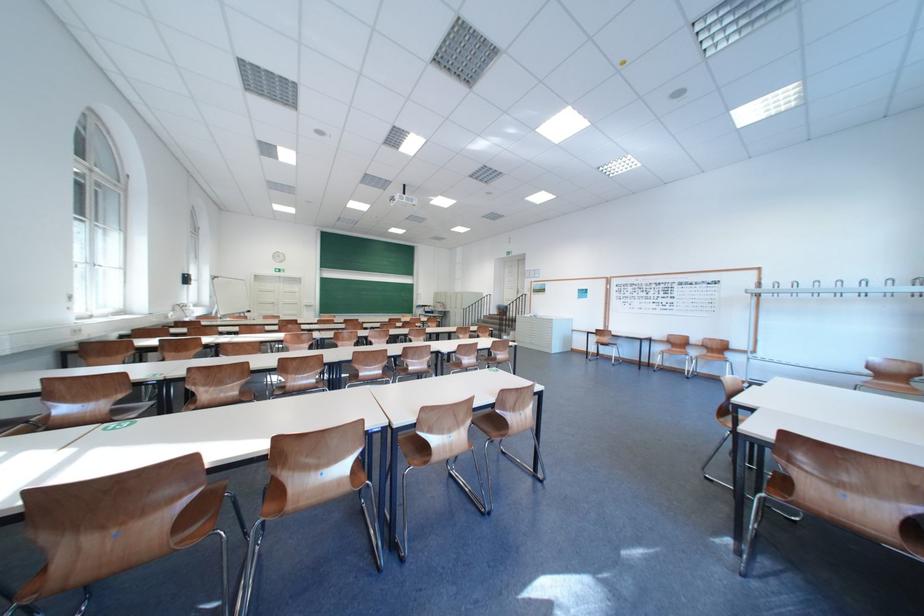
Locate an element on the screen. Image resolution: width=924 pixels, height=616 pixels. cabinet drawer handle is located at coordinates (780, 485).